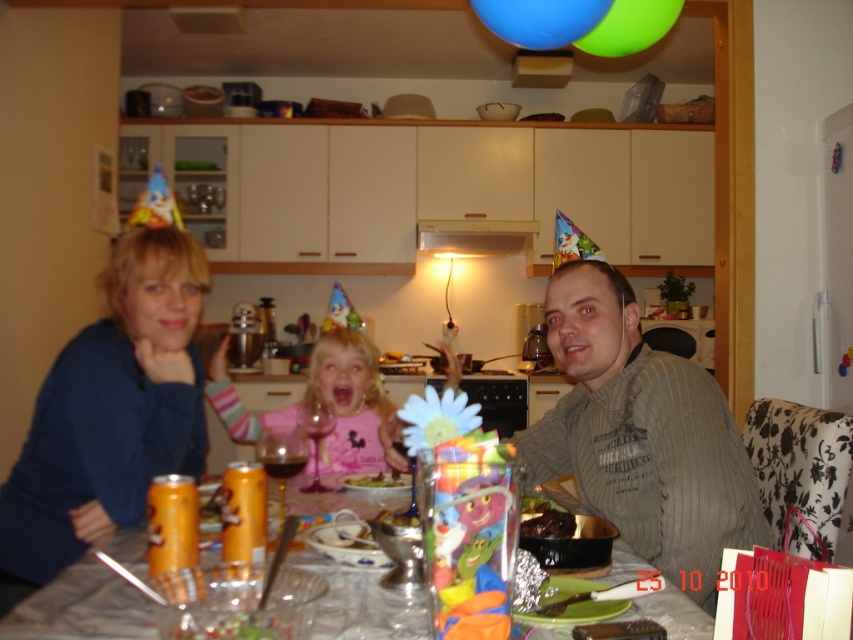
You are a photographer standing in the kitchen scene. You want to take a photo of the blue fleece sweater at left without moving any objects. Can you position yourself so that the camera is exactly 4.32 feet away from the sweater?

Yes, since the blue fleece sweater at left and camera are 4.32 feet apart, you can position the camera exactly 4.32 feet away from the sweater to take the photo.